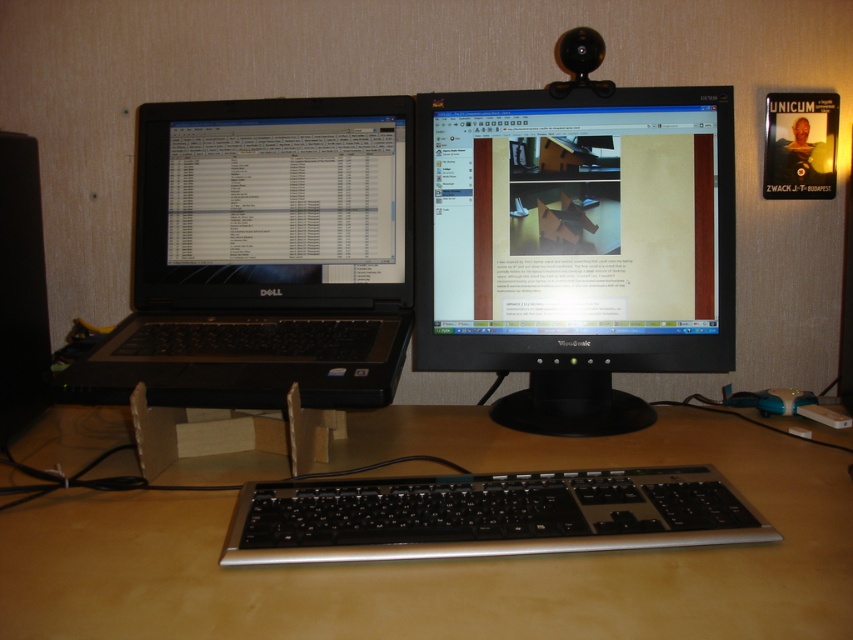
You are a drone operator trying to navigate between two points in the workspace. The first point is at coordinate point(434, 608) and the second point is at coordinate point(656, 477). Which point is closer to you?

Point(434, 608) is closer to the viewer than point(656, 477).